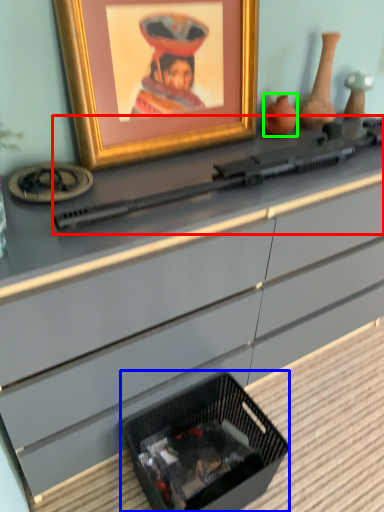
Question: Estimate the real-world distances between objects in this image. Which object is closer to weapon (highlighted by a red box), basket (highlighted by a blue box) or vase (highlighted by a green box)?

Choices:
 (A) basket
 (B) vase

Answer: (B)